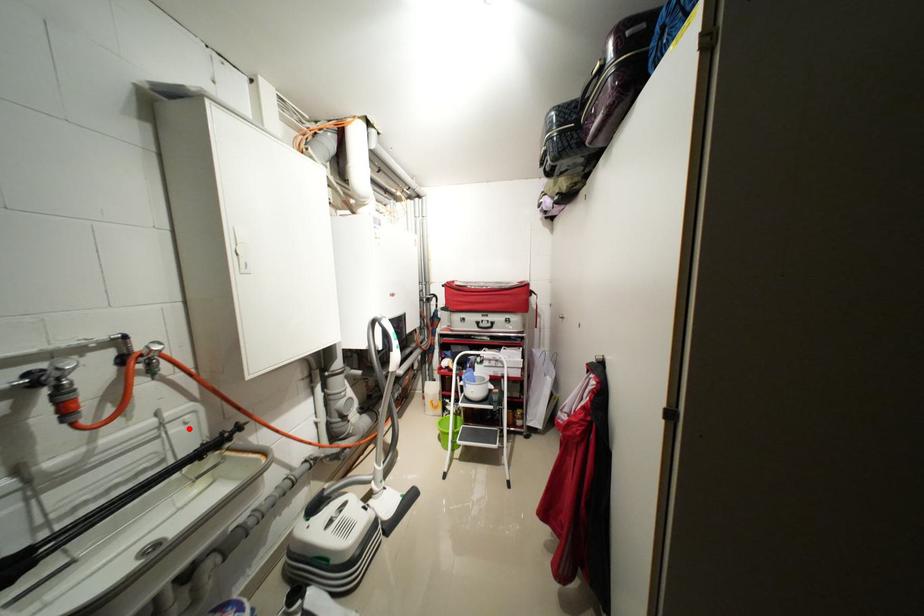
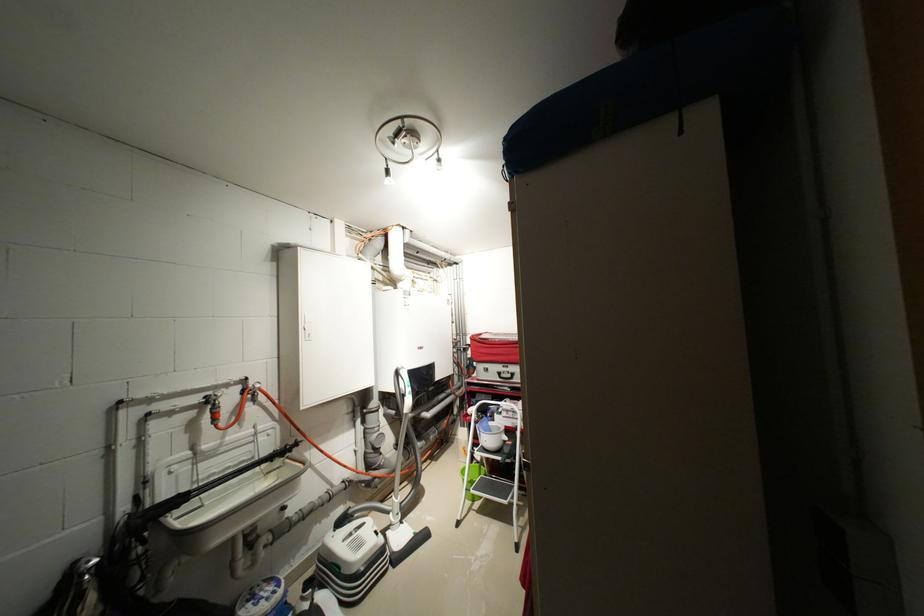
Find the pixel in the second image that matches the highlighted location in the first image.

(273, 439)